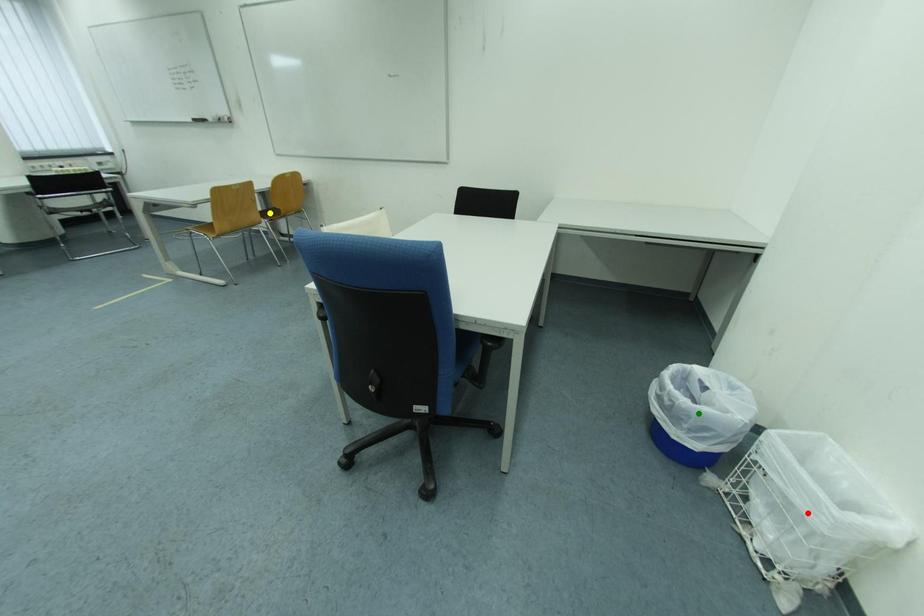
Order these from nearest to farthest:
1. yellow point
2. red point
3. green point

1. red point
2. green point
3. yellow point